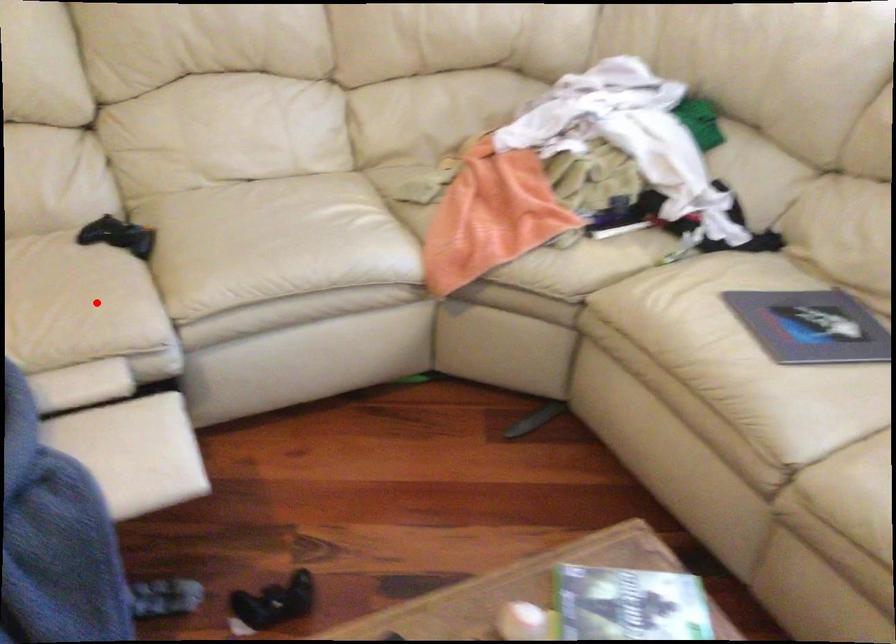
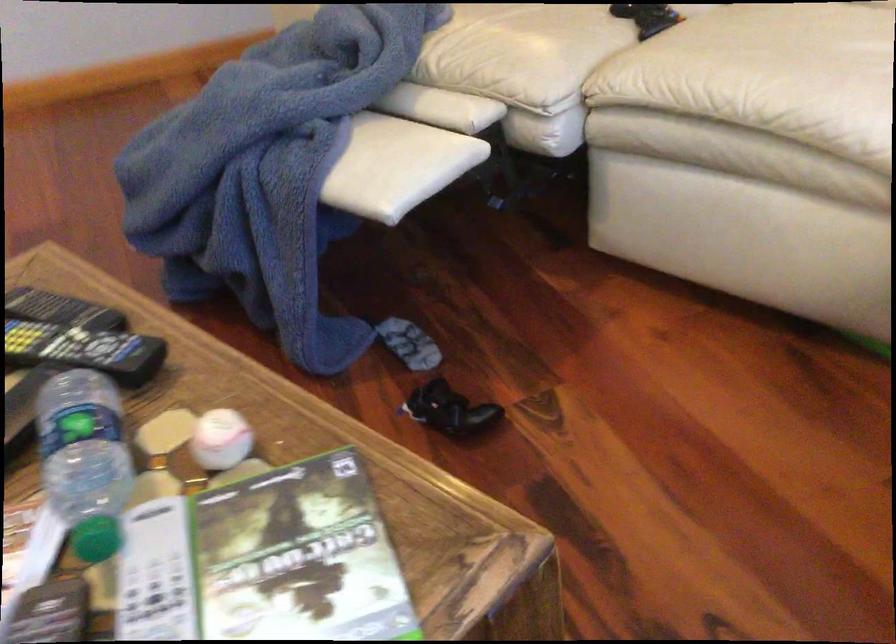
Where in the second image is the point corresponding to the highlighted location from the first image?

(524, 51)